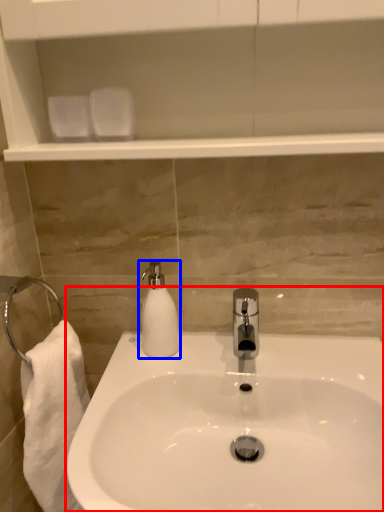
Question: Which object appears closest to the camera in this image, sink (highlighted by a red box) or soap dispenser (highlighted by a blue box)?

Choices:
 (A) sink
 (B) soap dispenser

Answer: (A)